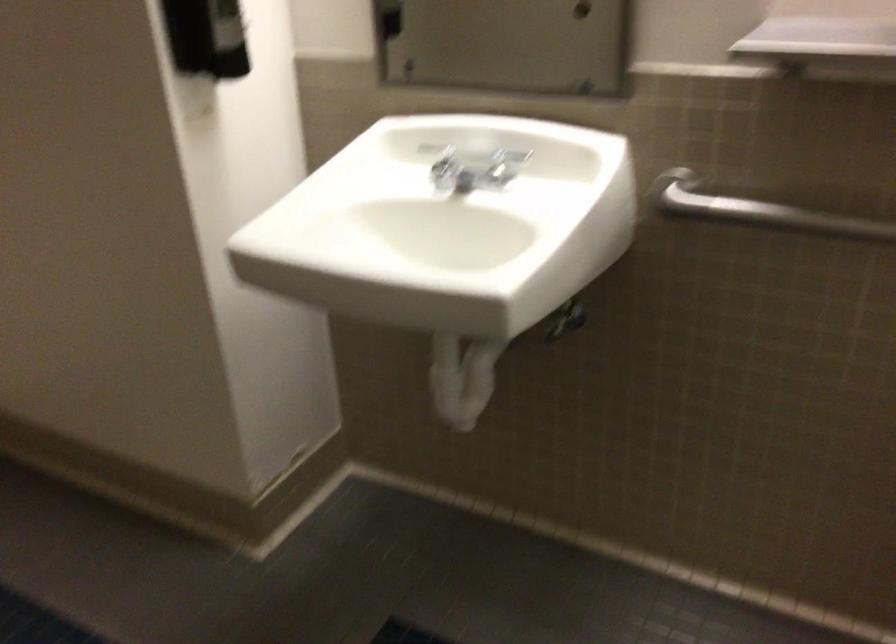
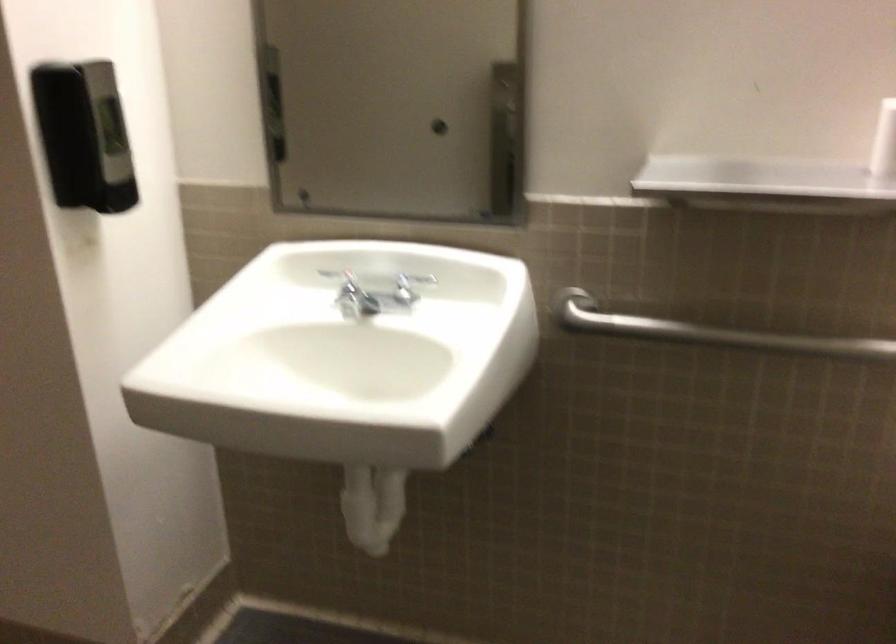
Question: The camera is either moving clockwise (left) or counter-clockwise (right) around the object. The first image is from the beginning of the video and the second image is from the end. Is the camera moving left or right when shooting the video?

Choices:
 (A) Left
 (B) Right

Answer: (A)